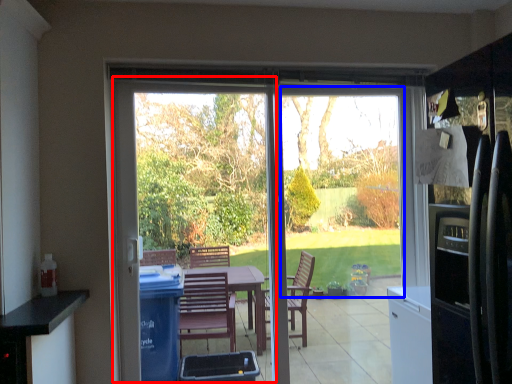
Question: Which point is closer to the camera, screen door (highlighted by a red box) or window screen (highlighted by a blue box)?

Choices:
 (A) screen door
 (B) window screen

Answer: (A)